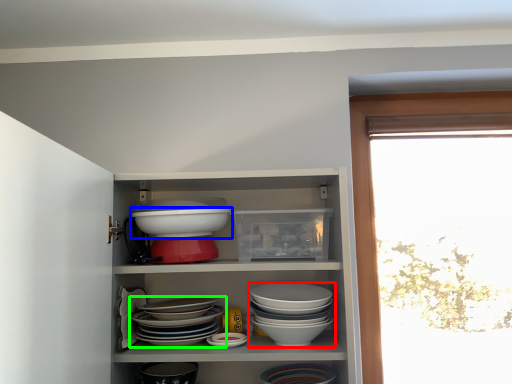
Question: Estimate the real-world distances between objects in this image. Which object is farther from bowl (highlighted by a red box), bowl (highlighted by a blue box) or bowl (highlighted by a green box)?

Choices:
 (A) bowl
 (B) bowl

Answer: (A)